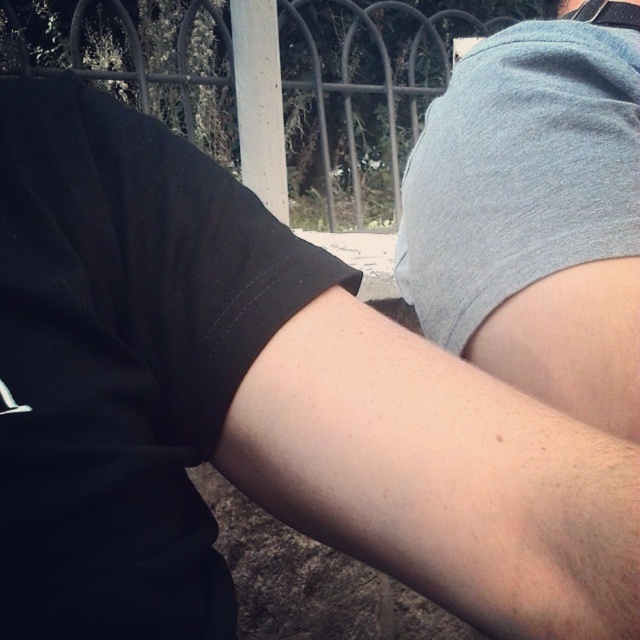
You are a photographer trying to capture a close shot of the skinny white arm at center and the gray cotton shirt at upper right. Since you want to focus on the details of both objects, which one should you adjust the camera focus for first considering their sizes?

The skinny white arm at center has a larger width than the gray cotton shirt at upper right, so you should adjust the camera focus for the skinny white arm at center first to ensure its details are captured clearly before focusing on the smaller gray cotton shirt at upper right.

You are a photographer trying to capture a candid shot of the two people in the scene. You want to ensure that the skinny white arm at center and the gray cotton shirt at upper right are both in focus. Based on their positions, which object should you focus on first to ensure both are sharp?

The skinny white arm at center is to the left of the gray cotton shirt at upper right, so focusing on the gray cotton shirt at upper right first would help ensure both are in focus since it is further away from the camera.